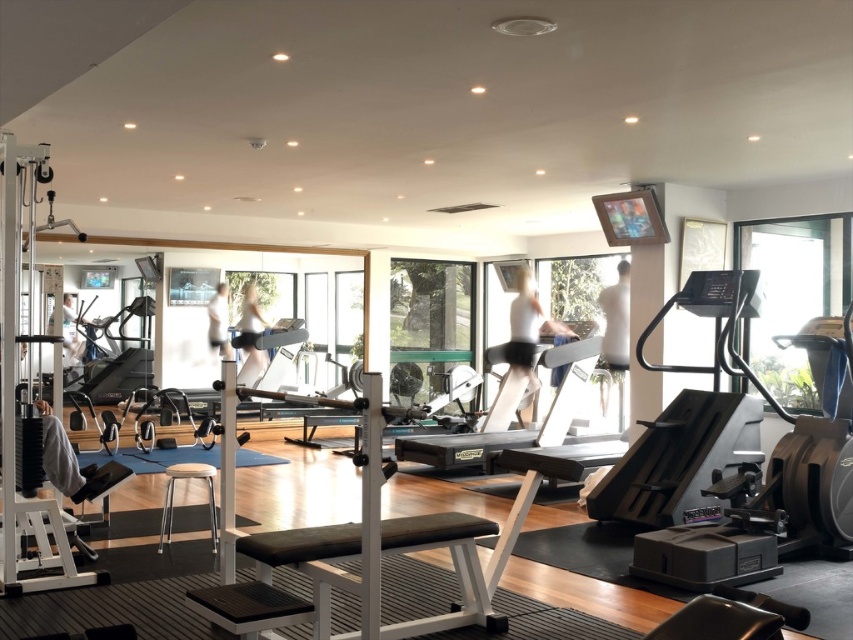
Does black plastic treadmill at center have a greater width compared to silver metallic treadmill at center?

No, black plastic treadmill at center is not wider than silver metallic treadmill at center.

Consider the image. Which is more to the left, black plastic treadmill at center or silver metallic treadmill at center?

silver metallic treadmill at center

Is point (641, 508) closer to viewer compared to point (474, 433)?

Yes, point (641, 508) is in front of point (474, 433).

Where is `black plastic treadmill at center`? Image resolution: width=853 pixels, height=640 pixels. black plastic treadmill at center is located at coordinates (685, 419).